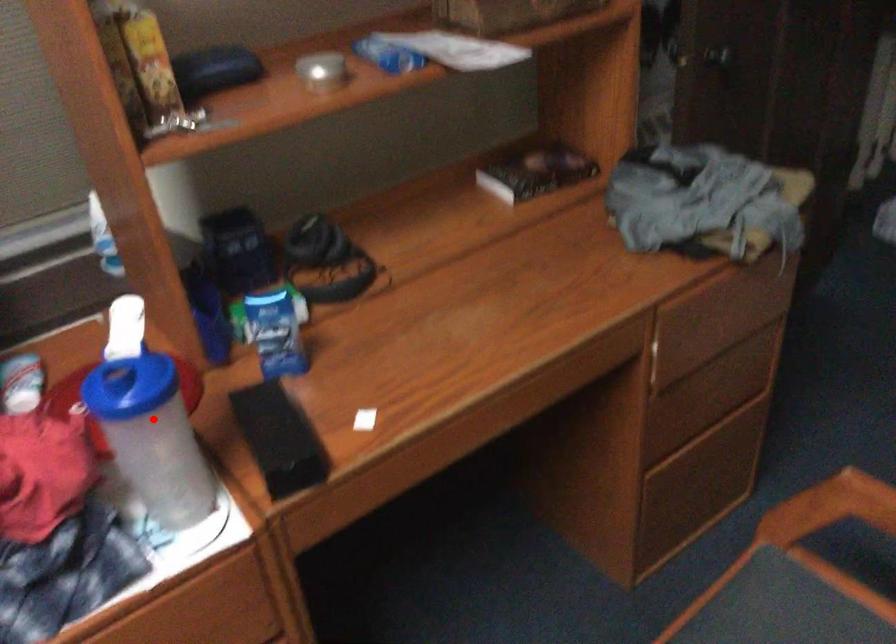
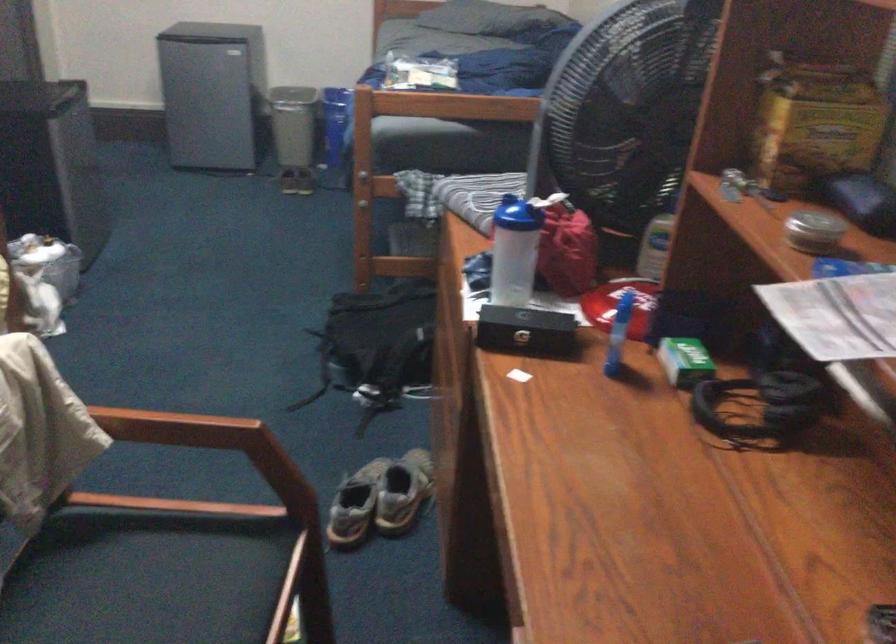
Question: I am providing you with two images of the same scene from different viewpoints. In image1, a red point is highlighted. Considering the same 3D point in image2, which of the following is correct?

Choices:
 (A) It is closer
 (B) It is farther

Answer: (B)